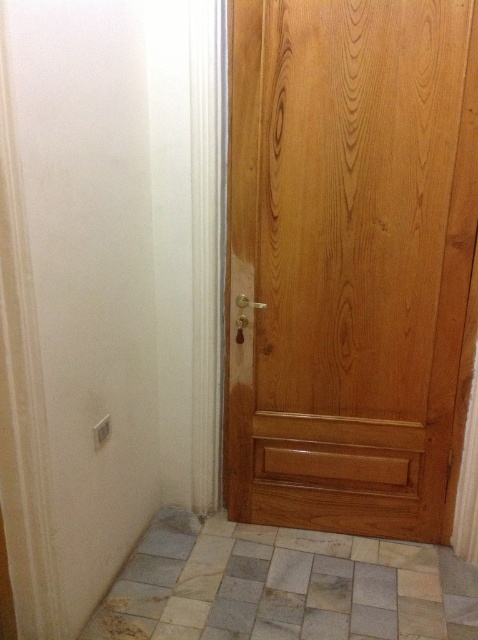
Is point (447, 1) positioned behind point (380, 548)?

That is False.

Does wooden door at right have a smaller size compared to natural stone tile at lower center?

No, wooden door at right is not smaller than natural stone tile at lower center.

Between point (365, 128) and point (434, 609), which one is positioned in front?

Point (365, 128) is more forward.

Identify the location of wooden door at right. This screenshot has width=478, height=640. (350, 260).